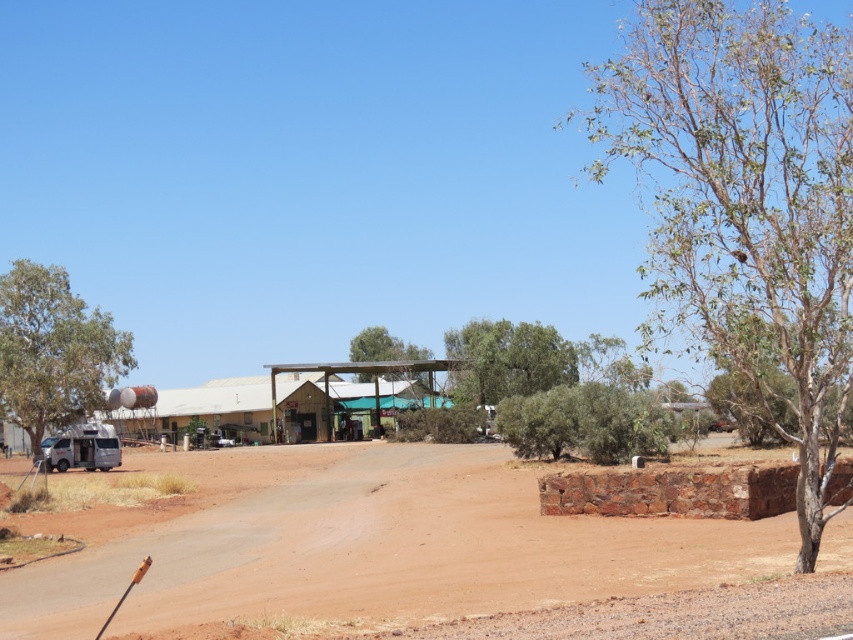
Question: Which is farther from the green leafy tree at left?

Choices:
 (A) brown textured tree at right
 (B) brown dirt field at lower left

Answer: (A)

Question: Does brown dirt field at lower left come in front of green leafy tree at left?

Choices:
 (A) no
 (B) yes

Answer: (B)

Question: Is brown textured tree at right positioned at the back of green leafy tree at left?

Choices:
 (A) no
 (B) yes

Answer: (A)

Question: Which of the following is the farthest from the observer?

Choices:
 (A) (721, 164)
 (B) (21, 593)
 (C) (86, 324)

Answer: (C)

Question: Which point is farther to the camera?

Choices:
 (A) brown dirt field at lower left
 (B) brown textured tree at right
 (C) green leafy tree at left

Answer: (C)

Question: Does brown textured tree at right have a greater width compared to green leafy tree at left?

Choices:
 (A) no
 (B) yes

Answer: (B)